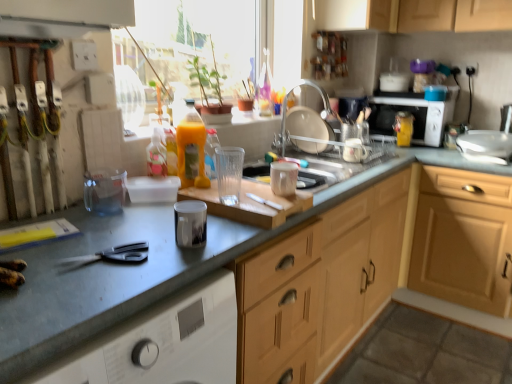
Question: Does matte white cup at center, the 4th appliance from the right, appear on the left side of black plastic scissors at lower left?

Choices:
 (A) no
 (B) yes

Answer: (A)

Question: From the image's perspective, is matte white cup at center, the 3th appliance from the left, beneath black plastic scissors at lower left?

Choices:
 (A) no
 (B) yes

Answer: (A)

Question: Is matte white cup at center, the 3th appliance from the left, shorter than black plastic scissors at lower left?

Choices:
 (A) no
 (B) yes

Answer: (A)

Question: Can you confirm if matte white cup at center, which is counted as the 4th appliance, starting from the back, is positioned to the right of black plastic scissors at lower left?

Choices:
 (A) yes
 (B) no

Answer: (A)

Question: From a real-world perspective, is matte white cup at center, which is the 5th appliance from top to bottom, located higher than black plastic scissors at lower left?

Choices:
 (A) yes
 (B) no

Answer: (A)

Question: Which is correct: white plastic microwave at upper right, the sixth appliance in the front-to-back sequence, is inside metallic gray countertop at center-left, which appears as the 1th countertop when viewed from the left, or outside of it?

Choices:
 (A) inside
 (B) outside

Answer: (B)

Question: Looking at the image, does white plastic microwave at upper right, the sixth appliance in the front-to-back sequence, seem bigger or smaller compared to metallic gray countertop at center-left, which ranks as the 2th countertop in right-to-left order?

Choices:
 (A) small
 (B) big

Answer: (A)

Question: Considering the positions of white plastic microwave at upper right, the sixth appliance in the front-to-back sequence, and metallic gray countertop at center-left, which ranks as the 2th countertop in right-to-left order, in the image, is white plastic microwave at upper right, the sixth appliance in the front-to-back sequence, taller or shorter than metallic gray countertop at center-left, which ranks as the 2th countertop in right-to-left order,?

Choices:
 (A) tall
 (B) short

Answer: (B)

Question: Based on their positions, is white plastic microwave at upper right, the 5th appliance positioned from the left, located to the left or right of metallic gray countertop at center-left, which appears as the 1th countertop when viewed from the left?

Choices:
 (A) left
 (B) right

Answer: (B)

Question: Would you say white ceramic mug at upper center, which is the second appliance in back-to-front order, is inside or outside yellow matte bottle at upper right, which is the first bottle from right to left?

Choices:
 (A) inside
 (B) outside

Answer: (B)

Question: Looking at their shapes, would you say white ceramic mug at upper center, which ranks as the 4th appliance in left-to-right order, is wider or thinner than yellow matte bottle at upper right, the first bottle when ordered from back to front?

Choices:
 (A) wide
 (B) thin

Answer: (B)

Question: From the image's perspective, is white ceramic mug at upper center, marked as the 3th appliance in a right-to-left arrangement, positioned above or below yellow matte bottle at upper right, acting as the 3th bottle starting from the left?

Choices:
 (A) below
 (B) above

Answer: (A)

Question: Considering the positions of white ceramic mug at upper center, which is counted as the 5th appliance, starting from the bottom, and yellow matte bottle at upper right, which is the first bottle from right to left, in the image, is white ceramic mug at upper center, which is counted as the 5th appliance, starting from the bottom, bigger or smaller than yellow matte bottle at upper right, which is the first bottle from right to left,?

Choices:
 (A) big
 (B) small

Answer: (B)

Question: In terms of size, does white plastic knife at center appear bigger or smaller than matte silver tap at upper center?

Choices:
 (A) small
 (B) big

Answer: (A)

Question: Based on their positions, is white plastic knife at center located to the left or right of matte silver tap at upper center?

Choices:
 (A) left
 (B) right

Answer: (A)